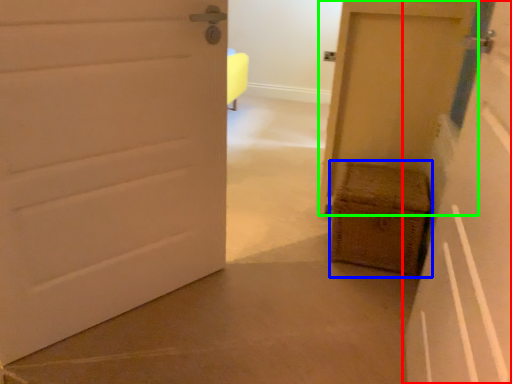
Question: Based on their relative distances, which object is nearer to door (highlighted by a red box)? Choose from basket (highlighted by a blue box) and door (highlighted by a green box).

Choices:
 (A) basket
 (B) door

Answer: (A)